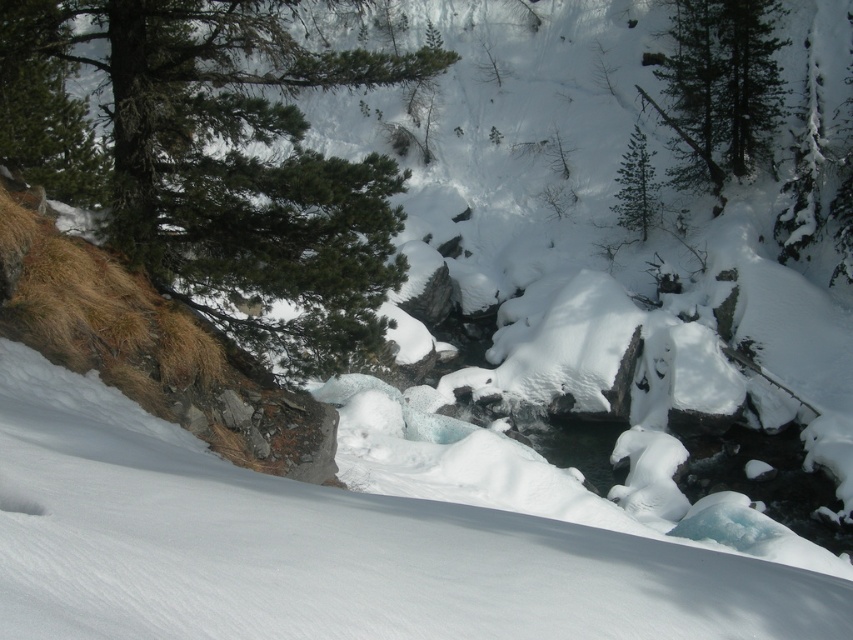
Can you confirm if green needle-like at upper left is smaller than green matte tree at upper center?

No, green needle-like at upper left is not smaller than green matte tree at upper center.

Who is positioned more to the right, green needle-like at upper left or green matte tree at upper center?

Positioned to the right is green matte tree at upper center.

Between point (166, 198) and point (669, 84), which one is positioned in front?

Point (166, 198) is in front.

Where is `green needle-like at upper left`? The height and width of the screenshot is (640, 853). green needle-like at upper left is located at coordinates (215, 161).